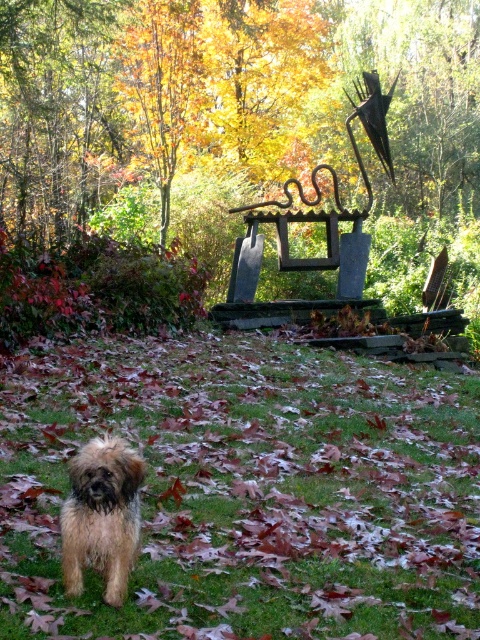
Question: Which point appears closest to the camera in this image?

Choices:
 (A) (227, 483)
 (B) (120, 604)

Answer: (B)

Question: Which point is farther to the camera?

Choices:
 (A) (133, 348)
 (B) (128, 534)

Answer: (A)

Question: Is green grass at center below fuzzy brown dog at lower left?

Choices:
 (A) no
 (B) yes

Answer: (B)

Question: In this image, where is green grass at center located relative to fuzzy brown dog at lower left?

Choices:
 (A) left
 (B) right

Answer: (B)

Question: Where is green grass at center located in relation to fuzzy brown dog at lower left in the image?

Choices:
 (A) above
 (B) below

Answer: (B)